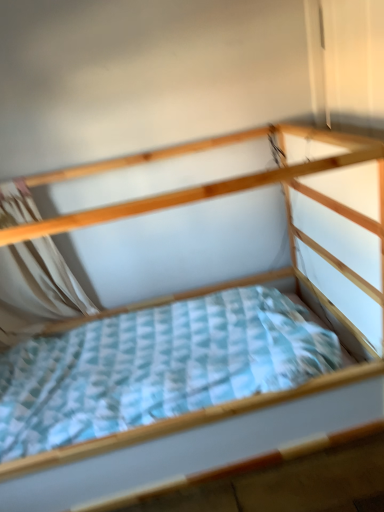
The height and width of the screenshot is (512, 384). What are the coordinates of `white sheer curtain at left` in the screenshot? It's located at (36, 290).

This screenshot has width=384, height=512. What do you see at coordinates (36, 290) in the screenshot?
I see `white sheer curtain at left` at bounding box center [36, 290].

What are the coordinates of `white sheer curtain at left` in the screenshot? It's located at (36, 290).